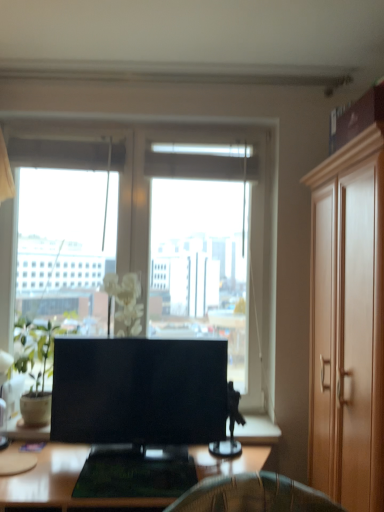
Question: Is light brown wood cabinet at right closer to camera compared to wooden desk at center?

Choices:
 (A) yes
 (B) no

Answer: (A)

Question: Is light brown wood cabinet at right bigger than wooden desk at center?

Choices:
 (A) yes
 (B) no

Answer: (A)

Question: Does light brown wood cabinet at right have a greater height compared to wooden desk at center?

Choices:
 (A) yes
 (B) no

Answer: (A)

Question: Considering the relative sizes of light brown wood cabinet at right and wooden desk at center in the image provided, is light brown wood cabinet at right shorter than wooden desk at center?

Choices:
 (A) yes
 (B) no

Answer: (B)

Question: Is light brown wood cabinet at right next to wooden desk at center?

Choices:
 (A) yes
 (B) no

Answer: (B)

Question: Is wooden desk at center taller or shorter than matte black tv at center?

Choices:
 (A) tall
 (B) short

Answer: (B)

Question: Considering the positions of point (211, 462) and point (223, 373), is point (211, 462) closer or farther from the camera than point (223, 373)?

Choices:
 (A) farther
 (B) closer

Answer: (B)

Question: Based on their sizes in the image, would you say wooden desk at center is bigger or smaller than matte black tv at center?

Choices:
 (A) big
 (B) small

Answer: (A)

Question: Is wooden desk at center inside the boundaries of matte black tv at center, or outside?

Choices:
 (A) inside
 (B) outside

Answer: (B)

Question: Is light brown wood cabinet at right wider or thinner than green matte plant at left?

Choices:
 (A) thin
 (B) wide

Answer: (B)

Question: From their relative heights in the image, would you say light brown wood cabinet at right is taller or shorter than green matte plant at left?

Choices:
 (A) tall
 (B) short

Answer: (A)

Question: Considering the relative positions of light brown wood cabinet at right and green matte plant at left in the image provided, is light brown wood cabinet at right to the left or to the right of green matte plant at left?

Choices:
 (A) right
 (B) left

Answer: (A)

Question: Does point (375, 478) appear closer or farther from the camera than point (48, 406)?

Choices:
 (A) closer
 (B) farther

Answer: (A)

Question: In terms of width, does green matte plant at left look wider or thinner when compared to light brown wood cabinet at right?

Choices:
 (A) wide
 (B) thin

Answer: (B)

Question: Is green matte plant at left in front of or behind light brown wood cabinet at right in the image?

Choices:
 (A) front
 (B) behind

Answer: (B)